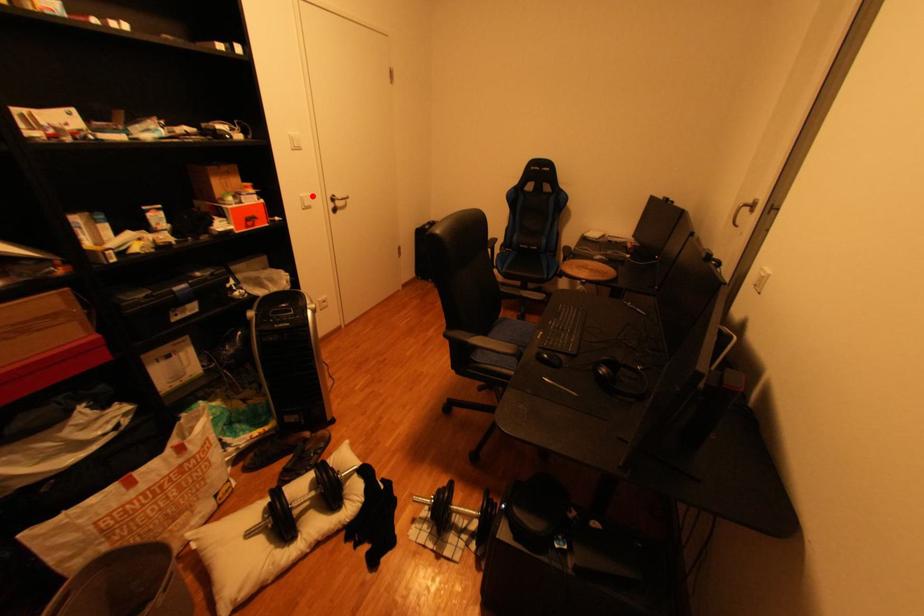
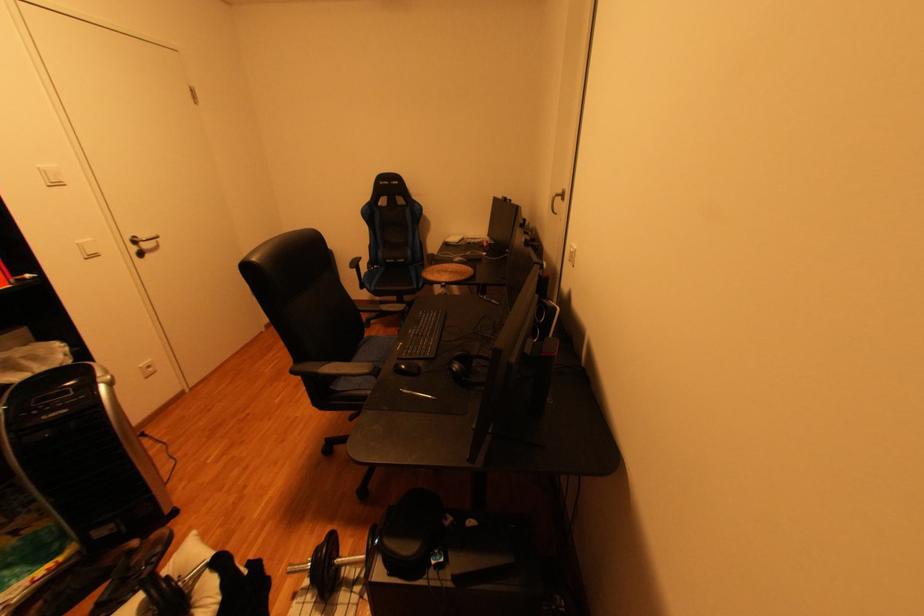
Where in the second image is the point corresponding to the highlighted location from the first image?

(89, 243)